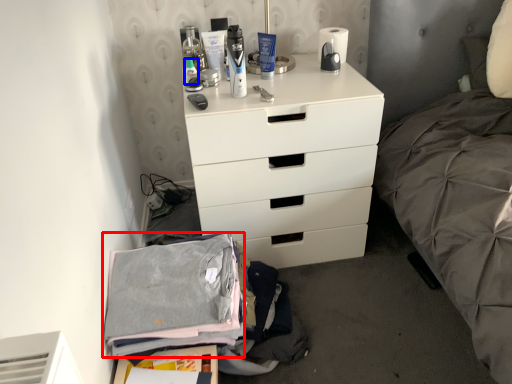
Question: Which object is closer to the camera taking this photo, clothing (highlighted by a red box) or toiletry (highlighted by a blue box)?

Choices:
 (A) clothing
 (B) toiletry

Answer: (A)